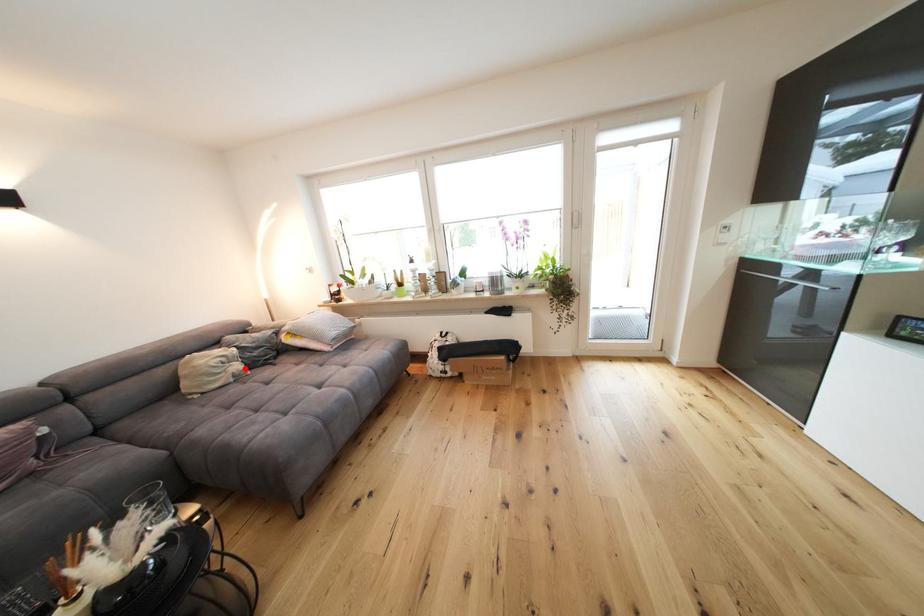
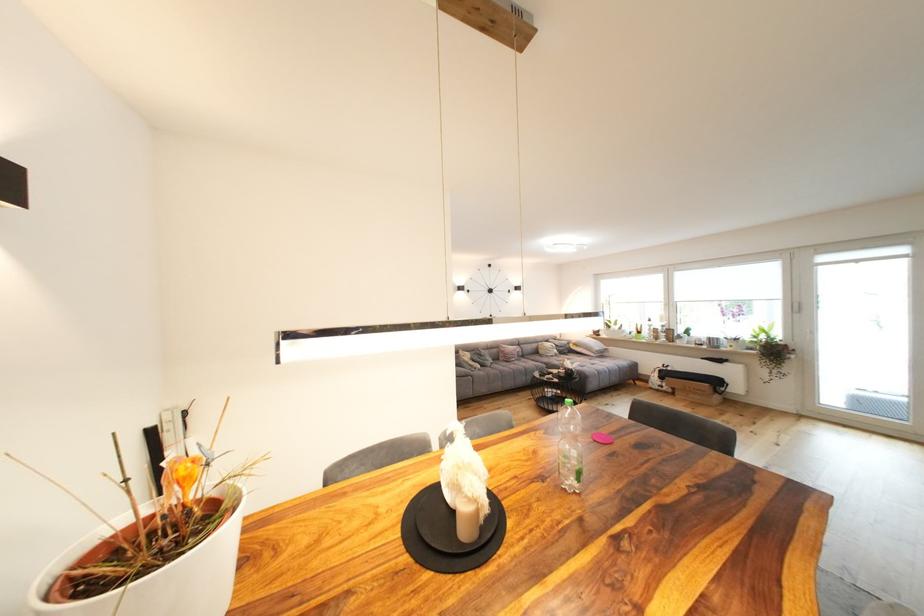
Question: A red point is marked in image1. In image2, is the corresponding 3D point closer to the camera or farther? Reply with the corresponding letter.

Choices:
 (A) The corresponding 3D point is closer.
 (B) The corresponding 3D point is farther.

Answer: (B)